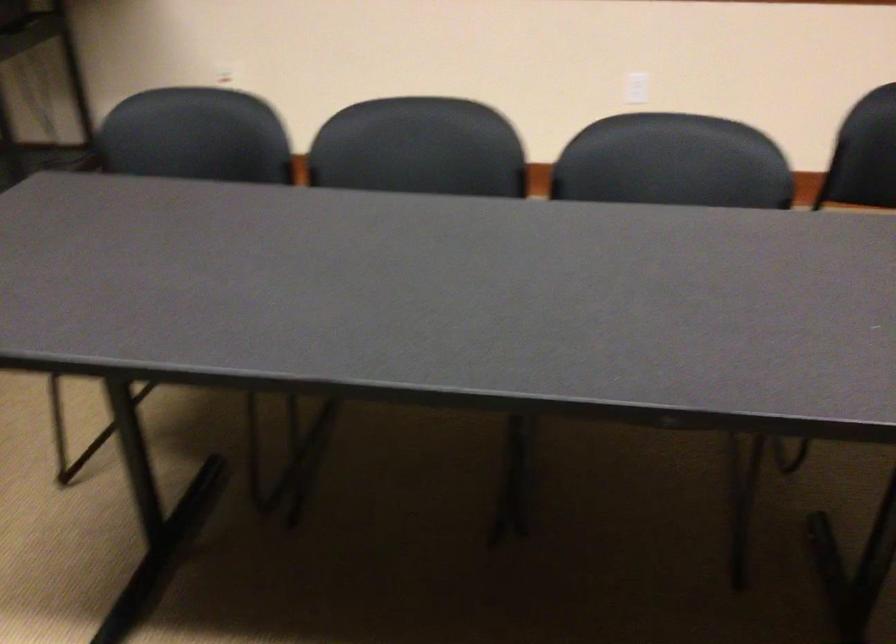
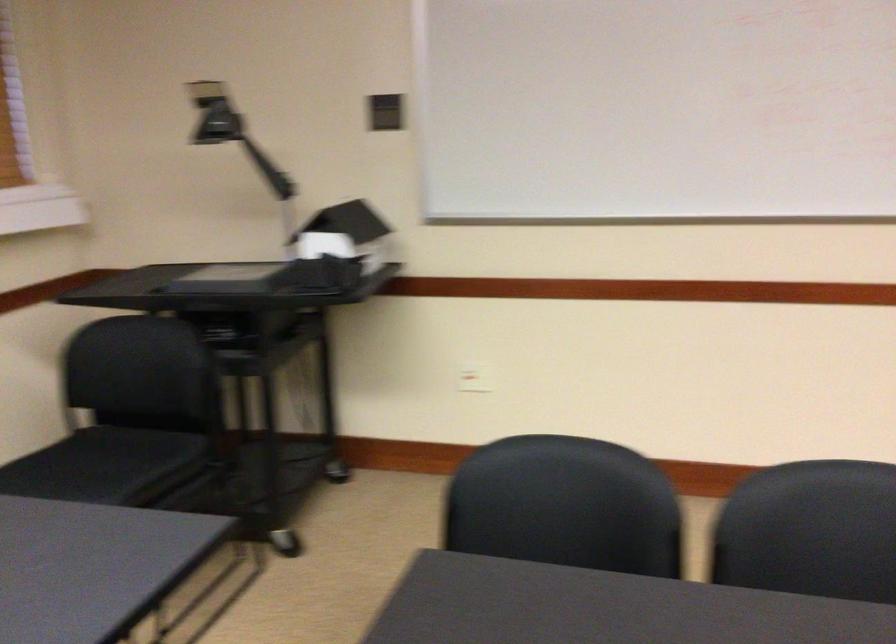
Find the pixel in the second image that matches pixel 202 140 in the first image.

(561, 494)